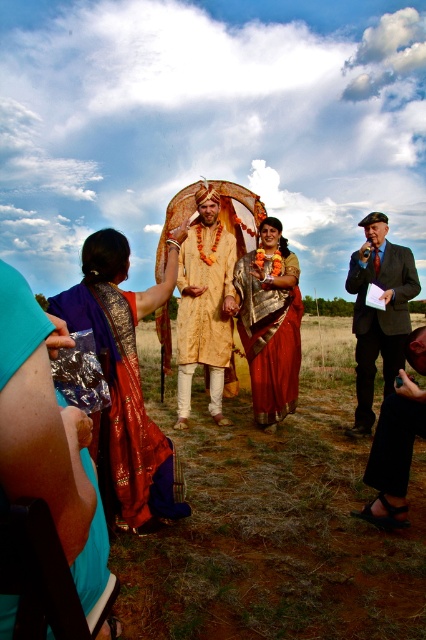
Question: Based on their relative distances, which object is farther from the suit at right?

Choices:
 (A) gold brocade kurta at center
 (B) silky purple sari at left
 (C) silky red saree at center

Answer: (B)

Question: Is silky red saree at center above black leather sandals at lower right?

Choices:
 (A) no
 (B) yes

Answer: (B)

Question: Does silky purple sari at left appear on the left side of silky red saree at center?

Choices:
 (A) yes
 (B) no

Answer: (A)

Question: Which point is farther from the camera taking this photo?

Choices:
 (A) (189, 396)
 (B) (362, 381)
 (C) (374, 483)
 (D) (296, 394)

Answer: (A)

Question: Is gold brocade kurta at center smaller than silky red saree at center?

Choices:
 (A) yes
 (B) no

Answer: (B)

Question: Which object is farther from the camera taking this photo?

Choices:
 (A) suit at right
 (B) black leather sandals at lower right

Answer: (A)